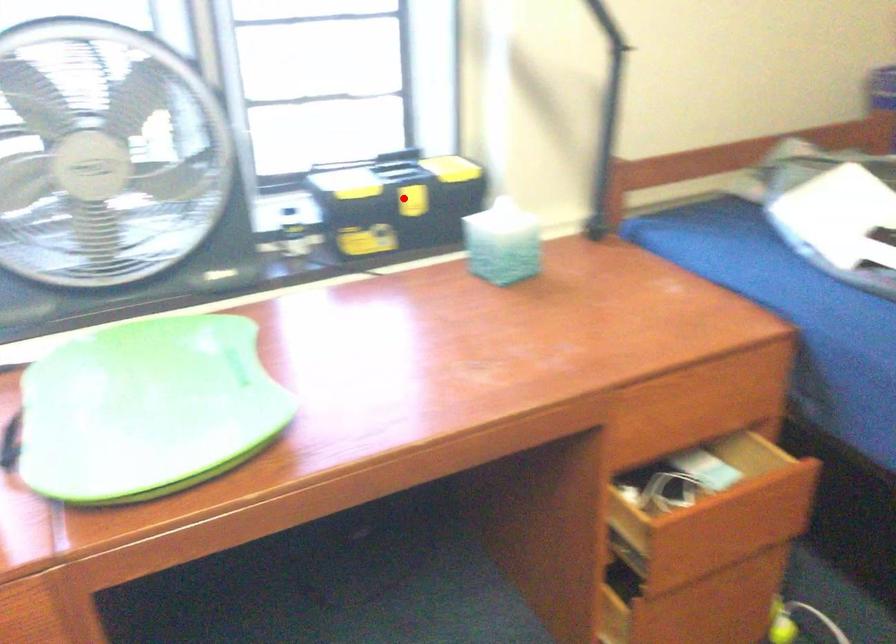
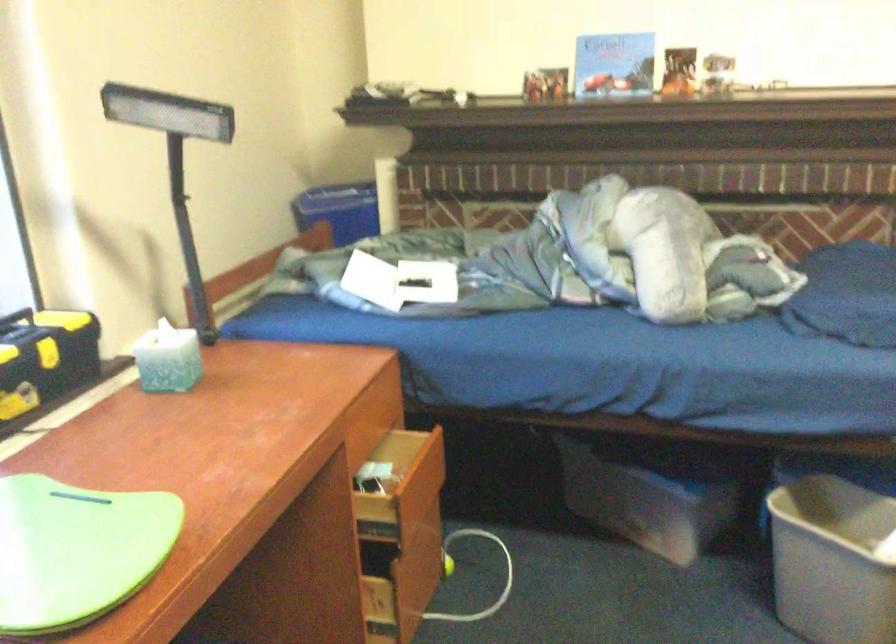
Locate, in the second image, the point that corresponds to the highlighted location in the first image.

(46, 354)